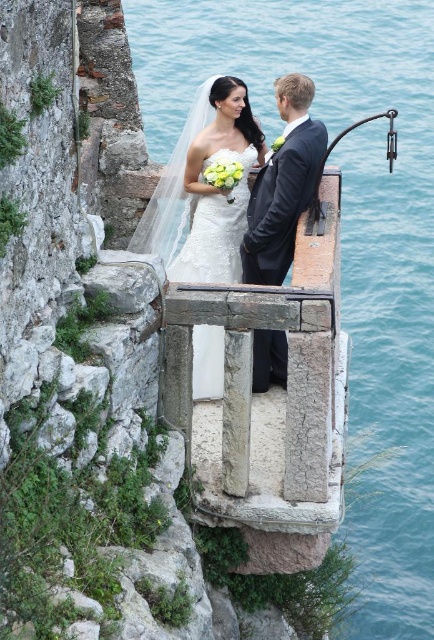
Does satin white dress at center have a greater height compared to matte black suit at center?

Yes, satin white dress at center is taller than matte black suit at center.

Can you confirm if satin white dress at center is smaller than matte black suit at center?

Actually, satin white dress at center might be larger than matte black suit at center.

Who is more forward, [188,257] or [268,273]?

Point [268,273]

You are a GUI agent. You are given a task and a screenshot of the screen. Output one action in this format:
    pyautogui.click(x=<x>, y=<y>)
    Task: Click on the satin white dress at center
    The width and height of the screenshot is (434, 640).
    Given the screenshot: What is the action you would take?
    pyautogui.click(x=219, y=188)

Based on the photo, is blue water at center smaller than matte black suit at center?

Actually, blue water at center might be larger than matte black suit at center.

Between point (142, 116) and point (260, 273), which one is positioned behind?

Positioned behind is point (142, 116).

Who is more forward, (x=246, y=32) or (x=276, y=204)?

Point (x=276, y=204)

Image resolution: width=434 pixels, height=640 pixels. Identify the location of blue water at center. (344, 241).

Is blue water at center to the left of satin white dress at center from the viewer's perspective?

Incorrect, blue water at center is not on the left side of satin white dress at center.

Identify the location of blue water at center. The height and width of the screenshot is (640, 434). (344, 241).